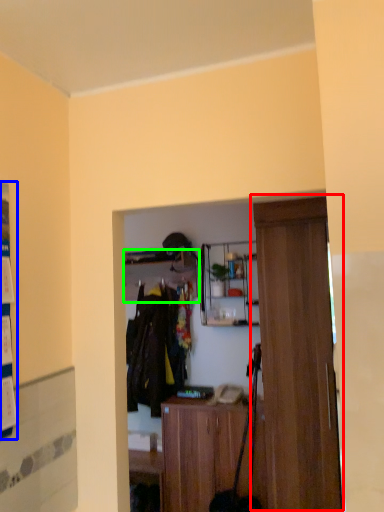
Question: Which object is positioned closest to door (highlighted by a red box)? Select from poster (highlighted by a blue box) and shelf (highlighted by a green box).

Choices:
 (A) poster
 (B) shelf

Answer: (B)